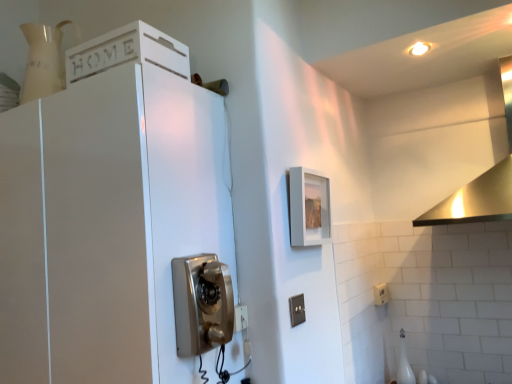
What do you see at coordinates (381, 294) in the screenshot? I see `white plastic electric outlet at lower right, which is counted as the second electric outlet, starting from the left` at bounding box center [381, 294].

You are a GUI agent. You are given a task and a screenshot of the screen. Output one action in this format:
    pyautogui.click(x=<x>, y=<y>)
    Task: Click on the matte gray picture frame at upper center
    
    Given the screenshot: What is the action you would take?
    pyautogui.click(x=309, y=207)

Find the location of a particular element. Image resolution: width=512 pixels, height=384 pixels. black plastic switch at lower center, the second electric outlet viewed from the right is located at coordinates (297, 309).

Image resolution: width=512 pixels, height=384 pixels. What do you see at coordinates (127, 52) in the screenshot? I see `white painted wood cabinet at upper left, positioned as the first cabinetry in top-to-bottom order` at bounding box center [127, 52].

The image size is (512, 384). What do you see at coordinates (202, 304) in the screenshot?
I see `metallic silver phone at center` at bounding box center [202, 304].

What are the coordinates of `white plastic electric outlet at lower right, which ranks as the second electric outlet in front-to-back order` in the screenshot? It's located at (381, 294).

Is white painted wood cabinet at upper left, which ranks as the 2th cabinetry in bottom-to-top order, directly adjacent to white glossy cabinet at upper left, the 1th cabinetry from the bottom?

No, white painted wood cabinet at upper left, which ranks as the 2th cabinetry in bottom-to-top order, is not with white glossy cabinet at upper left, the 1th cabinetry from the bottom.

Can you confirm if white painted wood cabinet at upper left, which ranks as the 2th cabinetry in bottom-to-top order, is smaller than white glossy cabinet at upper left, the 1th cabinetry from the bottom?

Correct, white painted wood cabinet at upper left, which ranks as the 2th cabinetry in bottom-to-top order, occupies less space than white glossy cabinet at upper left, the 1th cabinetry from the bottom.

Which is closer to the camera, (67, 61) or (22, 146)?

Point (67, 61).

Identify the location of picture frame behind the white painted wood cabinet at upper left, positioned as the first cabinetry in top-to-bottom order. The width and height of the screenshot is (512, 384). (309, 207).

From the image's perspective, which is above, white painted wood cabinet at upper left, positioned as the first cabinetry in top-to-bottom order, or matte gray picture frame at upper center?

white painted wood cabinet at upper left, positioned as the first cabinetry in top-to-bottom order, is shown above in the image.

Does white painted wood cabinet at upper left, which ranks as the 2th cabinetry in bottom-to-top order, contain matte gray picture frame at upper center?

Definitely not — matte gray picture frame at upper center is not inside white painted wood cabinet at upper left, which ranks as the 2th cabinetry in bottom-to-top order.

Considering the positions of points (136, 57) and (302, 211), is point (136, 57) farther from camera compared to point (302, 211)?

No, it is in front of (302, 211).

Which object is closer to the camera, white painted wood cabinet at upper left, positioned as the first cabinetry in top-to-bottom order, or black plastic switch at lower center, which is the second electric outlet in bottom-to-top order?

white painted wood cabinet at upper left, positioned as the first cabinetry in top-to-bottom order.

Is white painted wood cabinet at upper left, positioned as the first cabinetry in top-to-bottom order, to the left or to the right of black plastic switch at lower center, the second electric outlet viewed from the right, in the image?

From the image, it's evident that white painted wood cabinet at upper left, positioned as the first cabinetry in top-to-bottom order, is to the left of black plastic switch at lower center, the second electric outlet viewed from the right.

Can you tell me how much white painted wood cabinet at upper left, which ranks as the 2th cabinetry in bottom-to-top order, and black plastic switch at lower center, which is the second electric outlet in bottom-to-top order, differ in facing direction?

white painted wood cabinet at upper left, which ranks as the 2th cabinetry in bottom-to-top order, and black plastic switch at lower center, which is the second electric outlet in bottom-to-top order, are facing 1.66 degrees away from each other.

From a real-world perspective, is white painted wood cabinet at upper left, positioned as the first cabinetry in top-to-bottom order, above or below black plastic switch at lower center, marked as the first electric outlet in a left-to-right arrangement?

white painted wood cabinet at upper left, positioned as the first cabinetry in top-to-bottom order, is situated higher than black plastic switch at lower center, marked as the first electric outlet in a left-to-right arrangement, in the real world.

From a real-world perspective, who is located higher, white glossy cabinet at upper left, the 2th cabinetry viewed from the top, or stainless steel vent at upper right?

Answer: stainless steel vent at upper right is physically above.

Is the depth of white glossy cabinet at upper left, the 1th cabinetry from the bottom, less than that of stainless steel vent at upper right?

Yes.

Is white glossy cabinet at upper left, the 1th cabinetry from the bottom, directly adjacent to stainless steel vent at upper right?

There is a gap between white glossy cabinet at upper left, the 1th cabinetry from the bottom, and stainless steel vent at upper right.

Considering the sizes of white glossy cabinet at upper left, the 2th cabinetry viewed from the top, and stainless steel vent at upper right in the image, is white glossy cabinet at upper left, the 2th cabinetry viewed from the top, wider or thinner than stainless steel vent at upper right?

In the image, white glossy cabinet at upper left, the 2th cabinetry viewed from the top, appears to be more narrow than stainless steel vent at upper right.

Is white plastic electric outlet at lower right, which is the first electric outlet in right-to-left order, not inside black plastic switch at lower center, the second electric outlet viewed from the right?

Indeed, white plastic electric outlet at lower right, which is the first electric outlet in right-to-left order, is completely outside black plastic switch at lower center, the second electric outlet viewed from the right.

You are a GUI agent. You are given a task and a screenshot of the screen. Output one action in this format:
    pyautogui.click(x=<x>, y=<y>)
    Task: Click on the electric outlet in front of the white plastic electric outlet at lower right, which appears as the 1th electric outlet when viewed from the back
    This screenshot has width=512, height=384.
    Given the screenshot: What is the action you would take?
    pyautogui.click(x=297, y=309)

From a real-world perspective, is white plastic electric outlet at lower right, which ranks as the second electric outlet in front-to-back order, on black plastic switch at lower center, the second electric outlet viewed from the right?

Incorrect, from a real-world perspective, white plastic electric outlet at lower right, which ranks as the second electric outlet in front-to-back order, is lower than black plastic switch at lower center, the second electric outlet viewed from the right.

Which is in front, white plastic electric outlet at lower right, acting as the second electric outlet starting from the top, or black plastic switch at lower center, which is the first electric outlet in front-to-back order?

black plastic switch at lower center, which is the first electric outlet in front-to-back order, is more forward.

From a real-world perspective, is stainless steel vent at upper right physically located above or below white plastic electric outlet at lower right, which appears as the 1th electric outlet when viewed from the back?

stainless steel vent at upper right is situated higher than white plastic electric outlet at lower right, which appears as the 1th electric outlet when viewed from the back, in the real world.

Are stainless steel vent at upper right and white plastic electric outlet at lower right, which is counted as the second electric outlet, starting from the left, far apart?

No.

Is stainless steel vent at upper right completely or partially outside of white plastic electric outlet at lower right, acting as the second electric outlet starting from the top?

stainless steel vent at upper right is positioned outside white plastic electric outlet at lower right, acting as the second electric outlet starting from the top.

Considering the sizes of objects stainless steel vent at upper right and white plastic electric outlet at lower right, which is counted as the second electric outlet, starting from the left, in the image provided, who is wider, stainless steel vent at upper right or white plastic electric outlet at lower right, which is counted as the second electric outlet, starting from the left,?

stainless steel vent at upper right is wider.

Consider the image. Is stainless steel vent at upper right inside the boundaries of white painted wood cabinet at upper left, which ranks as the 2th cabinetry in bottom-to-top order, or outside?

stainless steel vent at upper right exists outside the volume of white painted wood cabinet at upper left, which ranks as the 2th cabinetry in bottom-to-top order.

Between stainless steel vent at upper right and white painted wood cabinet at upper left, positioned as the first cabinetry in top-to-bottom order, which one appears on the right side from the viewer's perspective?

stainless steel vent at upper right is more to the right.

Where is `vent behind the white painted wood cabinet at upper left, positioned as the first cabinetry in top-to-bottom order`? Image resolution: width=512 pixels, height=384 pixels. vent behind the white painted wood cabinet at upper left, positioned as the first cabinetry in top-to-bottom order is located at coordinates (482, 179).

Measure the distance from stainless steel vent at upper right to white painted wood cabinet at upper left, which ranks as the 2th cabinetry in bottom-to-top order.

stainless steel vent at upper right and white painted wood cabinet at upper left, which ranks as the 2th cabinetry in bottom-to-top order, are 1.17 meters apart from each other.

Identify the location of cabinetry located on the right of white glossy cabinet at upper left, the 1th cabinetry from the bottom. The image size is (512, 384). (127, 52).

The image size is (512, 384). In order to click on picture frame that appears behind the white painted wood cabinet at upper left, which ranks as the 2th cabinetry in bottom-to-top order in this screenshot , I will do `click(309, 207)`.

From the image, which object appears to be nearer to metallic silver phone at center, white plastic electric outlet at lower right, which is counted as the second electric outlet, starting from the left, or black plastic switch at lower center, the second electric outlet viewed from the right?

The object closer to metallic silver phone at center is black plastic switch at lower center, the second electric outlet viewed from the right.

Estimate the real-world distances between objects in this image. Which object is further from metallic silver phone at center, matte gray picture frame at upper center or white painted wood cabinet at upper left, which ranks as the 2th cabinetry in bottom-to-top order?

Among the two, white painted wood cabinet at upper left, which ranks as the 2th cabinetry in bottom-to-top order, is located further to metallic silver phone at center.

When comparing their distances from white plastic electric outlet at lower right, which ranks as the second electric outlet in front-to-back order, does white glossy cabinet at upper left, the 1th cabinetry from the bottom, or stainless steel vent at upper right seem closer?

Based on the image, stainless steel vent at upper right appears to be nearer to white plastic electric outlet at lower right, which ranks as the second electric outlet in front-to-back order.

Based on their spatial positions, is white plastic electric outlet at lower right, acting as the second electric outlet starting from the top, or stainless steel vent at upper right closer to matte gray picture frame at upper center?

The object closer to matte gray picture frame at upper center is stainless steel vent at upper right.

When comparing their distances from stainless steel vent at upper right, does matte gray picture frame at upper center or black plastic switch at lower center, which is the second electric outlet from back to front, seem closer?

Among the two, matte gray picture frame at upper center is located nearer to stainless steel vent at upper right.

Based on their spatial positions, is black plastic switch at lower center, marked as the first electric outlet in a left-to-right arrangement, or white plastic electric outlet at lower right, which appears as the 1th electric outlet when viewed from the back, further from matte gray picture frame at upper center?

Based on the image, white plastic electric outlet at lower right, which appears as the 1th electric outlet when viewed from the back, appears to be further to matte gray picture frame at upper center.

Based on their spatial positions, is white glossy cabinet at upper left, the 2th cabinetry viewed from the top, or white painted wood cabinet at upper left, which ranks as the 2th cabinetry in bottom-to-top order, closer to matte gray picture frame at upper center?

white glossy cabinet at upper left, the 2th cabinetry viewed from the top, is positioned closer to the anchor matte gray picture frame at upper center.

Looking at the image, which one is located closer to white plastic electric outlet at lower right, the 1th electric outlet from the bottom, matte gray picture frame at upper center or white glossy cabinet at upper left, the 1th cabinetry from the bottom?

matte gray picture frame at upper center is positioned closer to the anchor white plastic electric outlet at lower right, the 1th electric outlet from the bottom.

Identify the location of picture frame situated between metallic silver phone at center and stainless steel vent at upper right from left to right. (309, 207).

This screenshot has height=384, width=512. I want to click on electric outlet between metallic silver phone at center and white plastic electric outlet at lower right, acting as the second electric outlet starting from the top, in the front-back direction, so click(x=297, y=309).

The width and height of the screenshot is (512, 384). What are the coordinates of `picture frame between black plastic switch at lower center, which is the first electric outlet in front-to-back order, and stainless steel vent at upper right from left to right` in the screenshot? It's located at (309, 207).

The height and width of the screenshot is (384, 512). In order to click on cabinetry between white glossy cabinet at upper left, the 2th cabinetry viewed from the top, and stainless steel vent at upper right in this screenshot , I will do `click(127, 52)`.